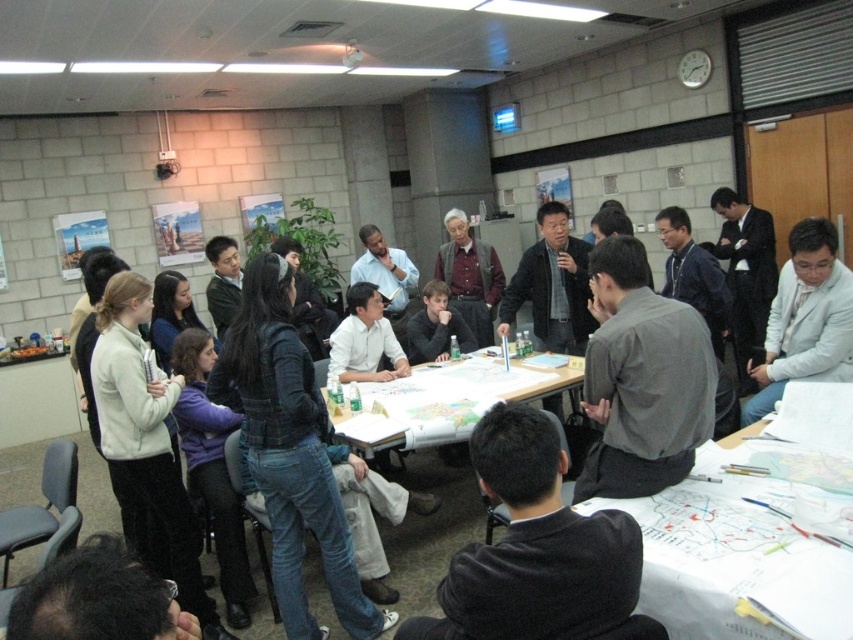
Is denim jacket at center wider than matte black shirt at center?

Yes, denim jacket at center is wider than matte black shirt at center.

Is denim jacket at center positioned at the back of matte black shirt at center?

No, denim jacket at center is closer to the viewer.

Image resolution: width=853 pixels, height=640 pixels. What are the coordinates of `denim jacket at center` in the screenshot? It's located at (289, 451).

Is point (173, 616) behind point (711, 198)?

No, (173, 616) is closer to viewer.

Is point (96, 552) positioned before point (752, 326)?

Yes, point (96, 552) is closer to viewer.

Who is more distant from viewer, (71, 557) or (750, 352)?

The point (750, 352) is behind.

Locate an element on the screen. The height and width of the screenshot is (640, 853). dark brown hair at lower center is located at coordinates (97, 598).

Is point (463, 221) positioned after point (466, 349)?

Yes, it is.

Between matte brown shirt at center and matte black shirt at center, which one is positioned higher?

matte brown shirt at center is above.

Where is `matte brown shirt at center`? matte brown shirt at center is located at coordinates (469, 275).